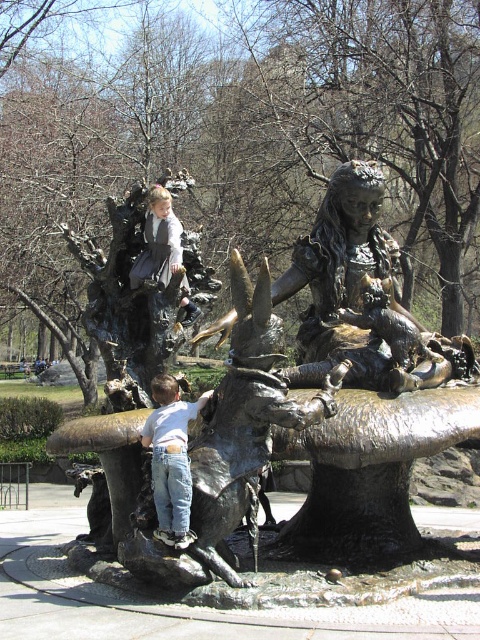
You are a photographer trying to capture a clear shot of the white matte shirt at lower center and the matte bronze statue at center. Since you want to focus on the details of the shirt, which object should you prioritize in your composition to ensure it stands out more due to its size?

The white matte shirt at lower center has a greater height compared to the matte bronze statue at center, so prioritizing the white matte shirt at lower center in the composition will make it stand out more due to its larger size.

You are an art student analyzing the sculpture. You notice the white matte shirt at lower center and the matte bronze statue at center. Which object appears bigger in the artwork?

The white matte shirt at lower center is larger in size than the matte bronze statue at center.